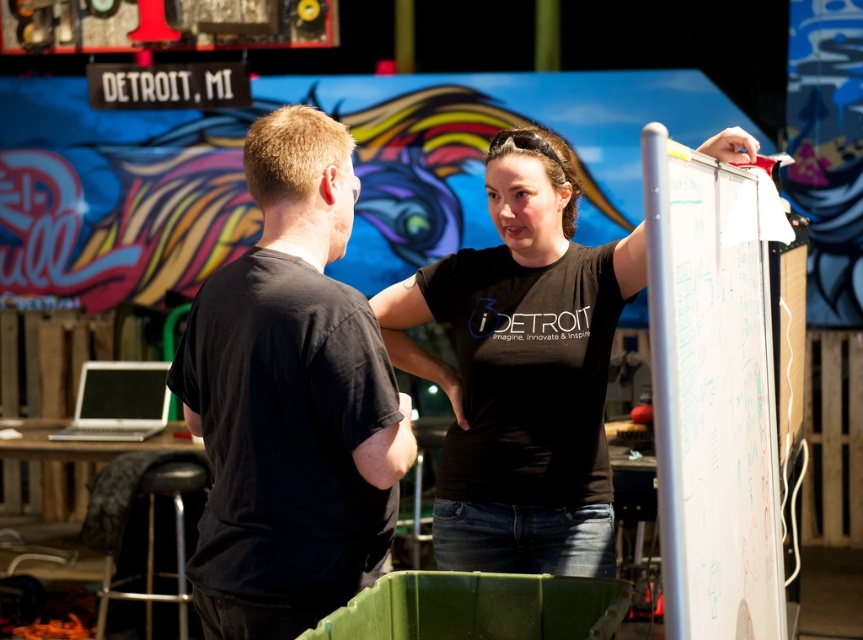
Question: Observing the image, what is the correct spatial positioning of black matte t-shirt at center in reference to black leather stool at lower left?

Choices:
 (A) above
 (B) below

Answer: (A)

Question: Among these objects, which one is nearest to the camera?

Choices:
 (A) black leather stool at lower left
 (B) black matte t-shirt at left
 (C) black matte t-shirt at center

Answer: (B)

Question: Is black matte t-shirt at center to the right of black leather stool at lower left from the viewer's perspective?

Choices:
 (A) no
 (B) yes

Answer: (B)

Question: Can you confirm if black matte t-shirt at left is wider than black matte t-shirt at center?

Choices:
 (A) no
 (B) yes

Answer: (A)

Question: Which point appears farthest from the camera in this image?

Choices:
 (A) (150, 499)
 (B) (495, 157)

Answer: (A)

Question: Among these points, which one is nearest to the camera?

Choices:
 (A) (187, 611)
 (B) (492, 420)
 (C) (232, 509)

Answer: (C)